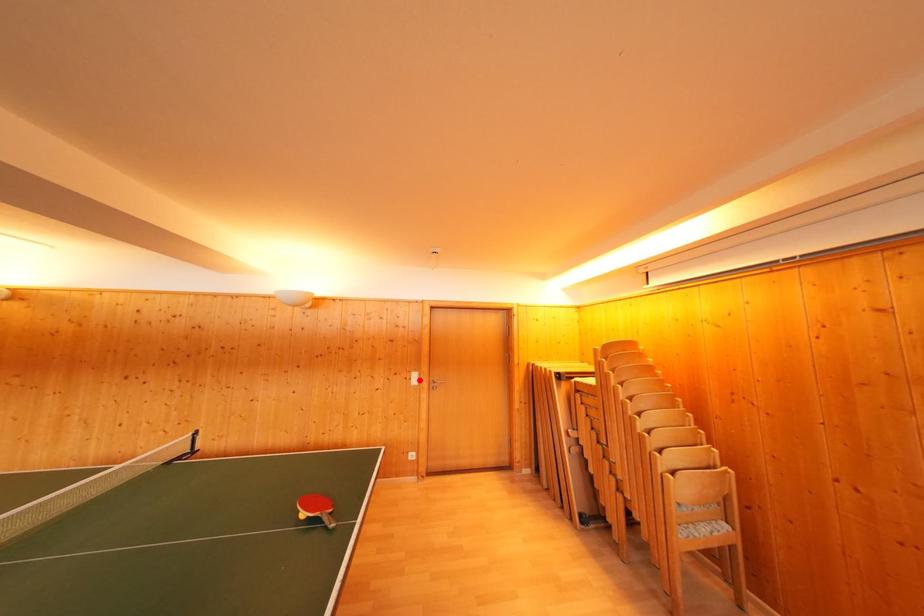
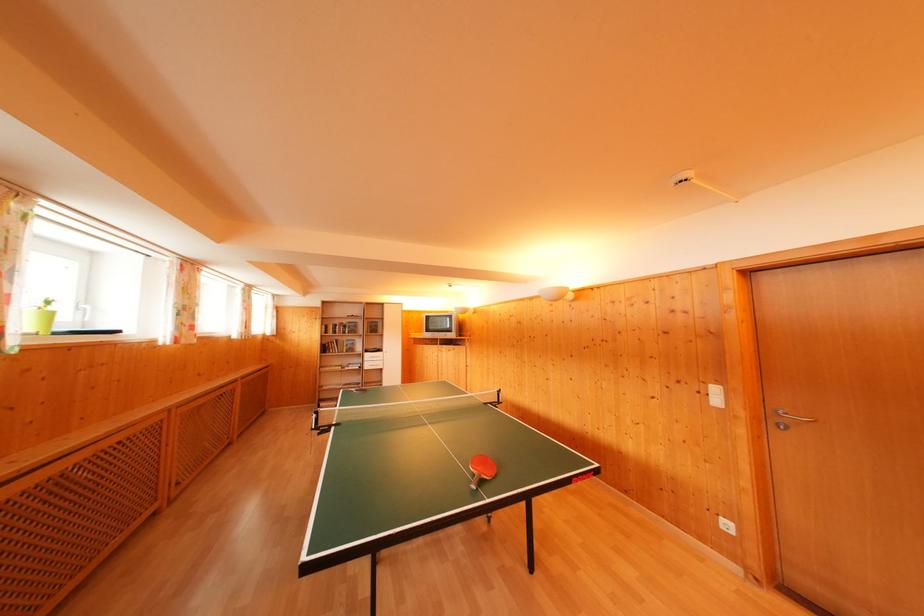
Question: I am providing you with two images of the same scene from different viewpoints. A red point is marked on the first image. Can you still see the location of the red point in image 2?

Choices:
 (A) Yes
 (B) No

Answer: (A)